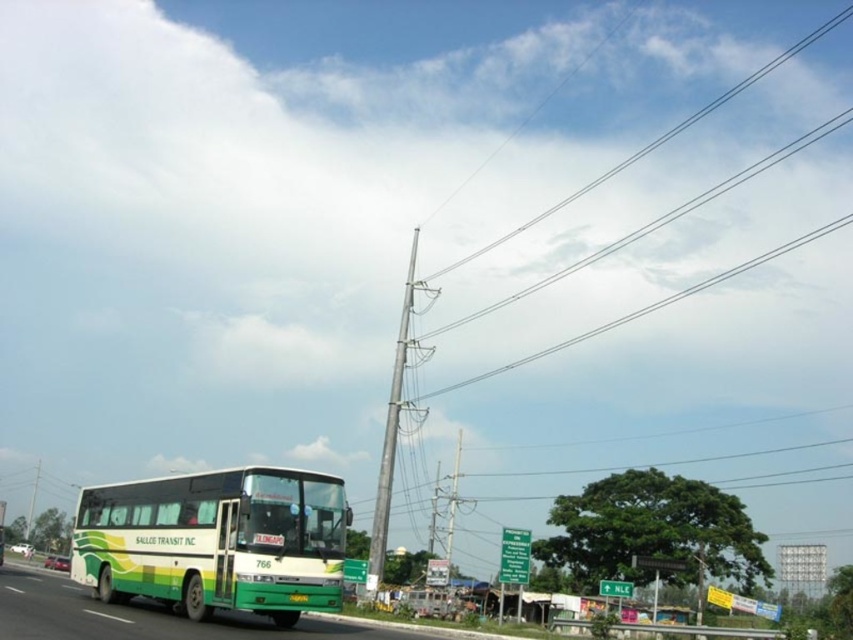
Which is more to the right, green matte bus at lower left or gray metallic pole at center?

Positioned to the right is gray metallic pole at center.

Does green matte bus at lower left have a greater height compared to gray metallic pole at center?

No.

Is point (35, 608) more distant than point (393, 452)?

No, (35, 608) is closer to viewer.

This screenshot has height=640, width=853. What are the coordinates of `green matte bus at lower left` in the screenshot? It's located at (155, 618).

Can you confirm if green matte bus at center is wider than gray metallic pole at center?

Yes, green matte bus at center is wider than gray metallic pole at center.

What do you see at coordinates (216, 541) in the screenshot? I see `green matte bus at center` at bounding box center [216, 541].

This screenshot has height=640, width=853. Identify the location of green matte bus at center. (216, 541).

Does silver metallic pole at upper center have a lesser height compared to gray metallic pole at center?

No, silver metallic pole at upper center is not shorter than gray metallic pole at center.

Does point (595, 49) come closer to viewer compared to point (393, 374)?

No, it is behind (393, 374).

In order to click on silver metallic pole at upper center in this screenshot , I will do `click(519, 291)`.